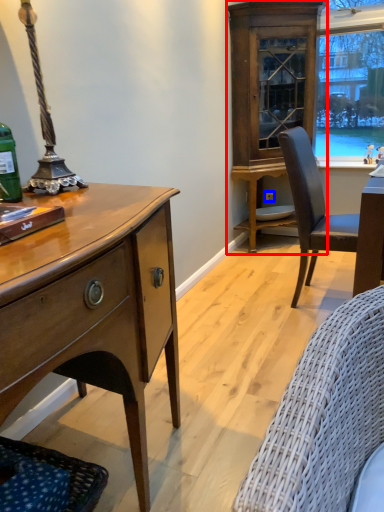
Question: Which point is further to the camera, cabinetry (highlighted by a red box) or power outlet (highlighted by a blue box)?

Choices:
 (A) cabinetry
 (B) power outlet

Answer: (B)